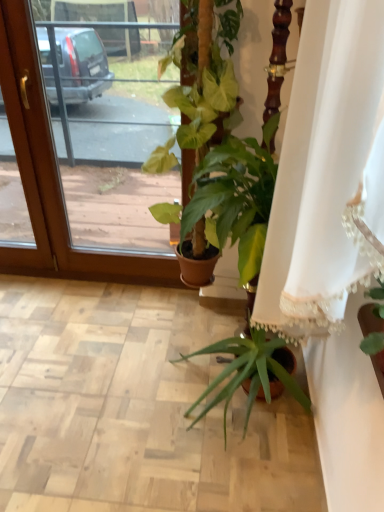
Question: Is transparent glass screen door at upper left facing away from green glossy plant at center?

Choices:
 (A) no
 (B) yes

Answer: (A)

Question: Is transparent glass screen door at upper left bigger than green glossy plant at center?

Choices:
 (A) no
 (B) yes

Answer: (B)

Question: Does transparent glass screen door at upper left have a smaller size compared to green glossy plant at center?

Choices:
 (A) yes
 (B) no

Answer: (B)

Question: Considering the relative positions of transparent glass screen door at upper left and green glossy plant at center in the image provided, is transparent glass screen door at upper left to the left of green glossy plant at center from the viewer's perspective?

Choices:
 (A) yes
 (B) no

Answer: (A)

Question: From a real-world perspective, is transparent glass screen door at upper left under green glossy plant at center?

Choices:
 (A) yes
 (B) no

Answer: (A)

Question: Is white lace curtain at center bigger or smaller than transparent glass screen door at upper left?

Choices:
 (A) small
 (B) big

Answer: (B)

Question: In the image, is white lace curtain at center positioned in front of or behind transparent glass screen door at upper left?

Choices:
 (A) behind
 (B) front

Answer: (B)

Question: Visually, is white lace curtain at center positioned to the left or to the right of transparent glass screen door at upper left?

Choices:
 (A) right
 (B) left

Answer: (A)

Question: In terms of height, does white lace curtain at center look taller or shorter compared to transparent glass screen door at upper left?

Choices:
 (A) short
 (B) tall

Answer: (A)

Question: From the image's perspective, is green glossy plant at center above or below transparent glass screen door at upper left?

Choices:
 (A) above
 (B) below

Answer: (B)

Question: Considering the positions of green glossy plant at center and transparent glass screen door at upper left in the image, is green glossy plant at center taller or shorter than transparent glass screen door at upper left?

Choices:
 (A) tall
 (B) short

Answer: (B)

Question: In terms of width, does green glossy plant at center look wider or thinner when compared to transparent glass screen door at upper left?

Choices:
 (A) thin
 (B) wide

Answer: (B)

Question: Is green glossy plant at center inside the boundaries of transparent glass screen door at upper left, or outside?

Choices:
 (A) outside
 (B) inside

Answer: (A)

Question: Considering their positions, is green glossy plant at center located in front of or behind white lace curtain at center?

Choices:
 (A) front
 (B) behind

Answer: (B)

Question: Considering the positions of green glossy plant at center and white lace curtain at center in the image, is green glossy plant at center taller or shorter than white lace curtain at center?

Choices:
 (A) short
 (B) tall

Answer: (B)